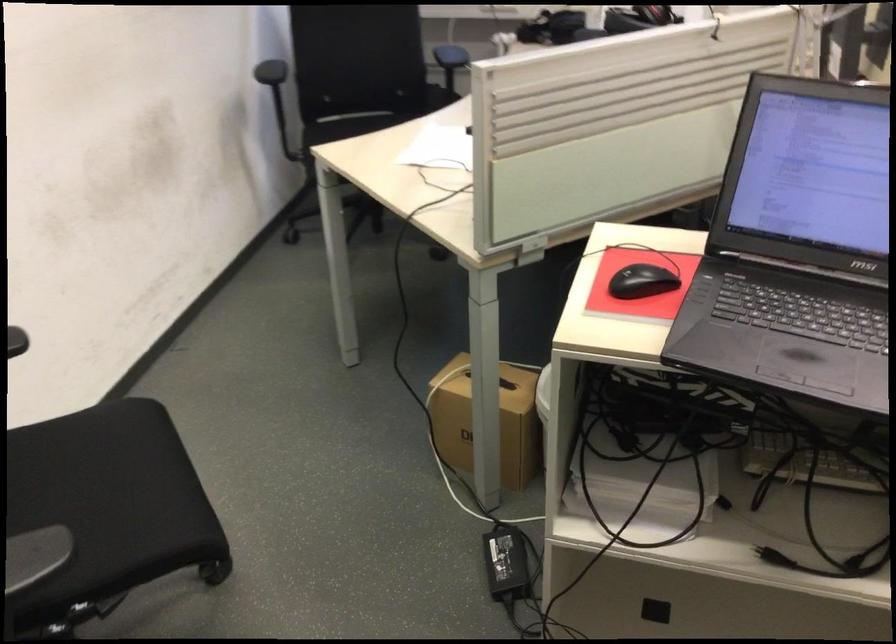
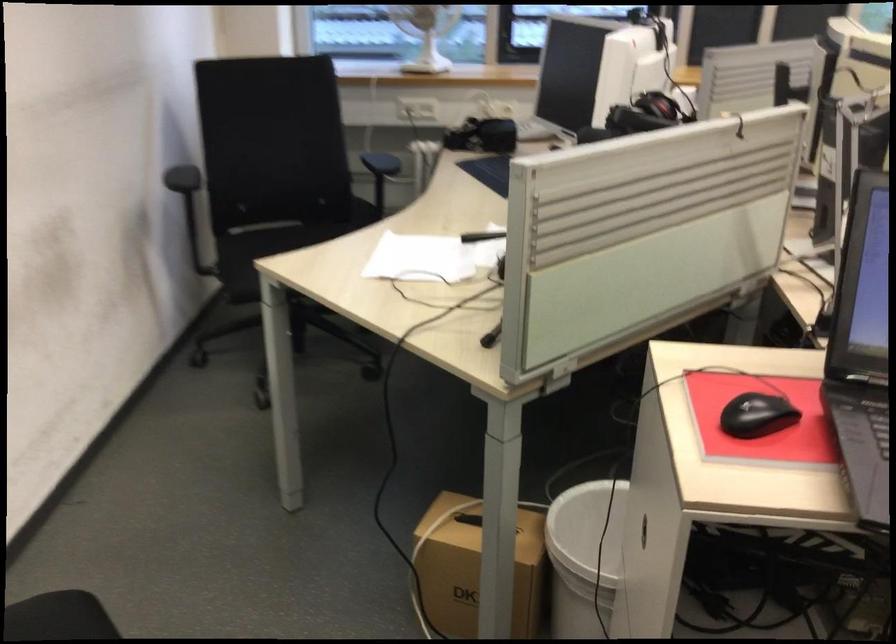
Find the pixel in the second image that matches (x=635, y=279) in the first image.

(756, 415)